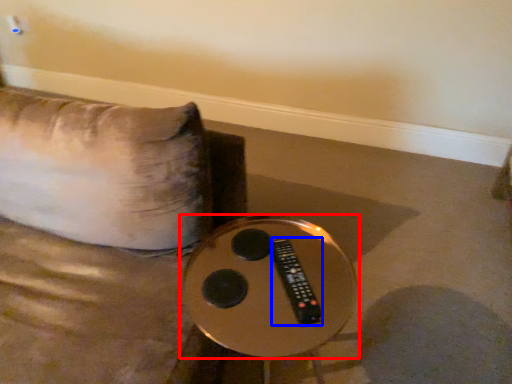
Question: Which object appears closest to the camera in this image, table (highlighted by a red box) or remote (highlighted by a blue box)?

Choices:
 (A) table
 (B) remote

Answer: (A)